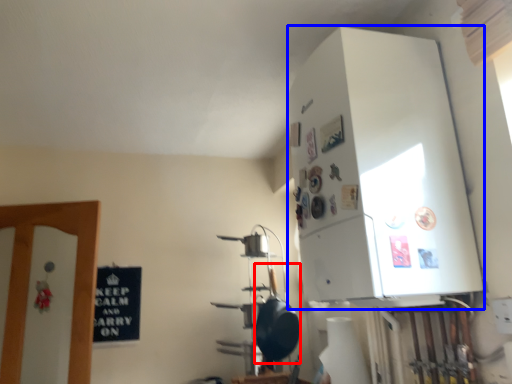
Question: Which of the following is the farthest to the observer, wok (highlighted by a red box) or appliance (highlighted by a blue box)?

Choices:
 (A) wok
 (B) appliance

Answer: (A)